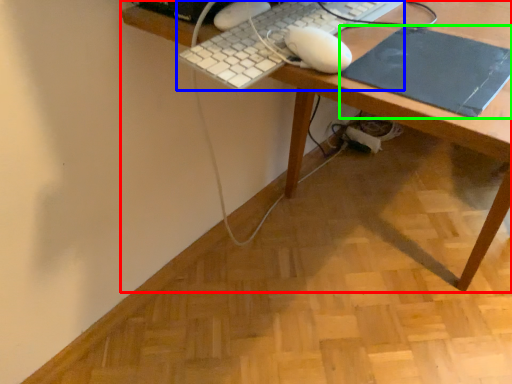
Question: Estimate the real-world distances between objects in this image. Which object is closer to desk (highlighted by a red box), computer keyboard (highlighted by a blue box) or mousepad (highlighted by a green box)?

Choices:
 (A) computer keyboard
 (B) mousepad

Answer: (B)